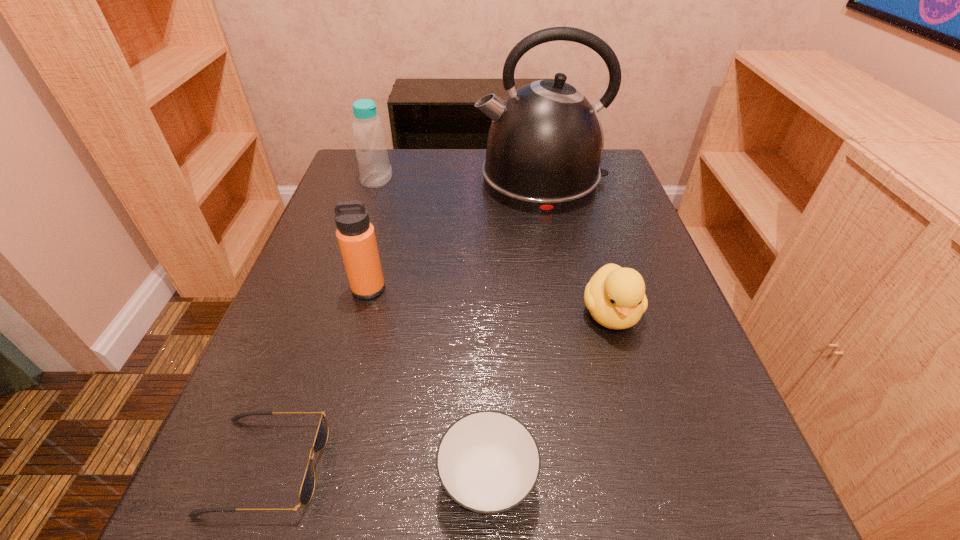
Locate an element on the screen. This screenshot has height=540, width=960. vacant point located between the thermos bottle and the sunglasses is located at coordinates click(x=318, y=377).

At what (x,y) coordinates should I click in order to perform the action: click on object that stands as the second closest to the duck. Please return your answer as a coordinate pair (x, y). Looking at the image, I should click on (545, 143).

Point out which object is positioned as the nearest to the kettle. Please provide its 2D coordinates. Your answer should be formatted as a tuple, i.e. [(x, y)], where the tuple contains the x and y coordinates of a point satisfying the conditions above.

[(370, 144)]

Locate an element on the screen. The height and width of the screenshot is (540, 960). free location that satisfies the following two spatial constraints: 1. on the back side of the soup bowl; 2. on the front-facing side of the sunglasses is located at coordinates (488, 465).

Find the location of a particular element. The height and width of the screenshot is (540, 960). free location that satisfies the following two spatial constraints: 1. on the front-facing side of the soup bowl; 2. on the right side of the shortest object is located at coordinates (260, 482).